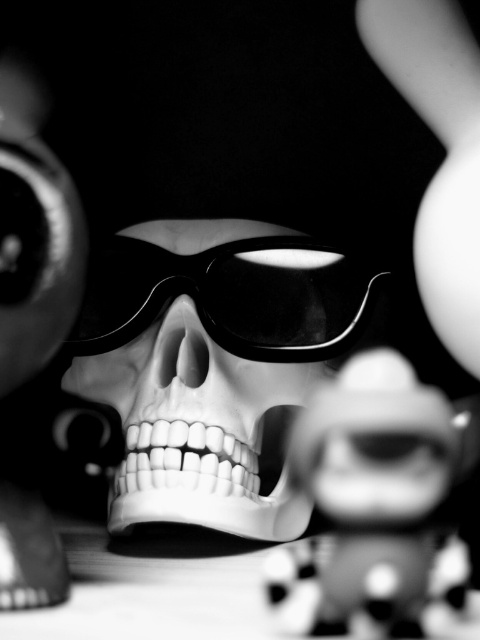
Question: Which object appears farthest from the camera in this image?

Choices:
 (A) smooth plastic skull at center
 (B) black glossy goggles at center

Answer: (B)

Question: Which point is farther to the camera?

Choices:
 (A) smooth plastic skull at center
 (B) black glossy goggles at center

Answer: (B)

Question: Is smooth plastic skull at center above black glossy goggles at center?

Choices:
 (A) yes
 (B) no

Answer: (B)

Question: Is polka dot fabric skull at center thinner than black glossy goggles at center?

Choices:
 (A) no
 (B) yes

Answer: (B)

Question: Does polka dot fabric skull at center have a smaller size compared to smooth plastic skull at center?

Choices:
 (A) yes
 (B) no

Answer: (B)

Question: Which point is closer to the camera taking this photo?

Choices:
 (A) (335, 252)
 (B) (192, 433)

Answer: (B)